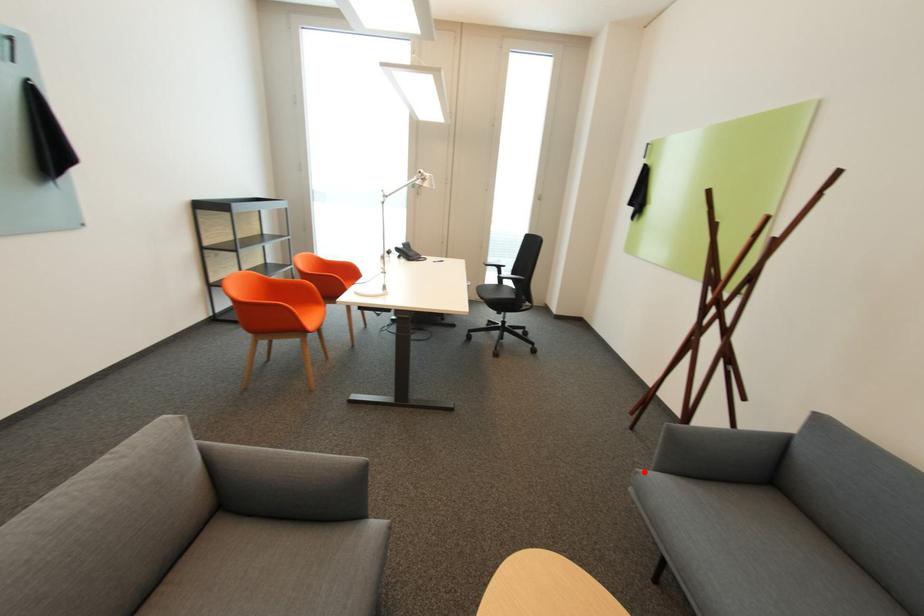
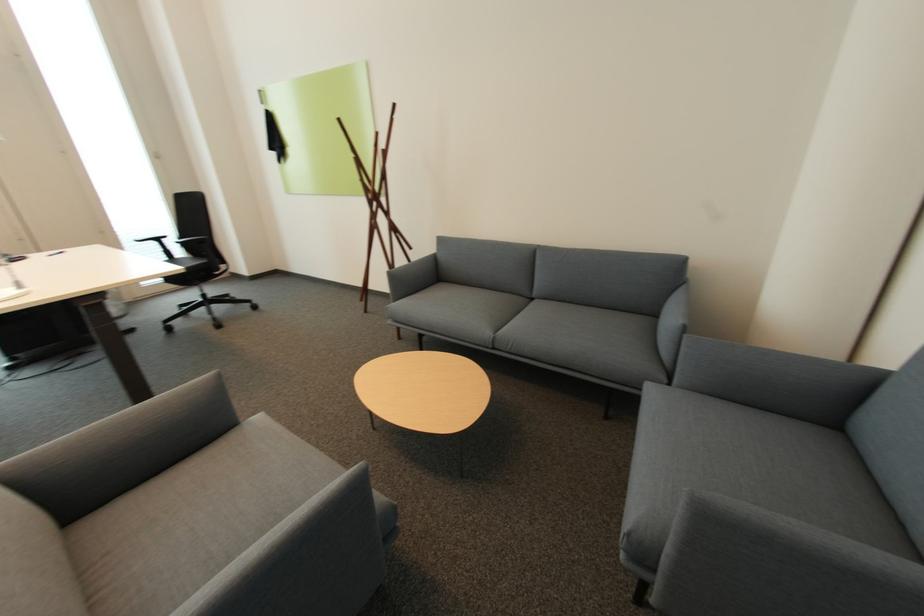
Question: I am providing you with two images of the same scene from different viewpoints. A red point is shown in image1. For the corresponding object point in image2, is it positioned nearer or farther from the camera?

Choices:
 (A) Nearer
 (B) Farther

Answer: (B)